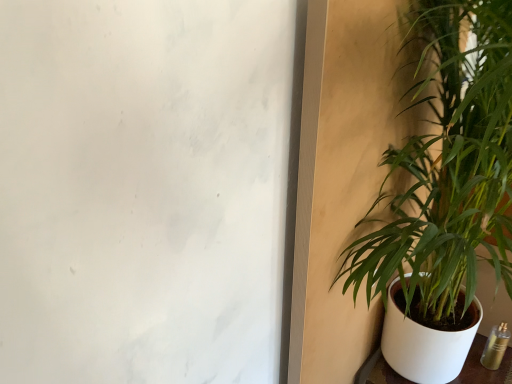
What do you see at coordinates (448, 168) in the screenshot?
I see `green leafy plant at right` at bounding box center [448, 168].

The height and width of the screenshot is (384, 512). Find the location of `green leafy plant at right`. green leafy plant at right is located at coordinates (448, 168).

The width and height of the screenshot is (512, 384). In order to click on white ceramic flowerpot at right in this screenshot , I will do [x=425, y=344].

Describe the element at coordinates (425, 344) in the screenshot. I see `white ceramic flowerpot at right` at that location.

I want to click on green leafy plant at right, so click(x=448, y=168).

Considering the relative positions of green leafy plant at right and white ceramic flowerpot at right in the image provided, is green leafy plant at right to the right of white ceramic flowerpot at right from the viewer's perspective?

No, green leafy plant at right is not to the right of white ceramic flowerpot at right.

Which is behind, green leafy plant at right or white ceramic flowerpot at right?

white ceramic flowerpot at right is behind.

Which point is more distant from viewer, (458, 152) or (391, 322)?

Point (391, 322)

From the image's perspective, does green leafy plant at right appear lower than white ceramic flowerpot at right?

Actually, green leafy plant at right appears above white ceramic flowerpot at right in the image.

From a real-world perspective, relative to white ceramic flowerpot at right, is green leafy plant at right vertically above or below?

green leafy plant at right is situated higher than white ceramic flowerpot at right in the real world.

Which of these two, green leafy plant at right or white ceramic flowerpot at right, is wider?

Wider between the two is white ceramic flowerpot at right.

Between green leafy plant at right and white ceramic flowerpot at right, which one has more height?

Standing taller between the two is green leafy plant at right.

Considering the sizes of objects green leafy plant at right and white ceramic flowerpot at right in the image provided, who is bigger, green leafy plant at right or white ceramic flowerpot at right?

Bigger between the two is green leafy plant at right.

Is green leafy plant at right not within white ceramic flowerpot at right?

That's correct, green leafy plant at right is outside of white ceramic flowerpot at right.

Would you consider green leafy plant at right to be distant from white ceramic flowerpot at right?

No, there isn't a large distance between green leafy plant at right and white ceramic flowerpot at right.

Is green leafy plant at right oriented towards white ceramic flowerpot at right?

No, green leafy plant at right is not facing towards white ceramic flowerpot at right.

How different are the orientations of green leafy plant at right and white ceramic flowerpot at right in degrees?

The angle between the facing direction of green leafy plant at right and the facing direction of white ceramic flowerpot at right is 1.37 degrees.

Measure the distance from green leafy plant at right to white ceramic flowerpot at right.

green leafy plant at right is 9.24 inches from white ceramic flowerpot at right.

At what (x,y) coordinates should I click in order to perform the action: click on flowerpot below the green leafy plant at right (from a real-world perspective). Please return your answer as a coordinate pair (x, y). Looking at the image, I should click on (425, 344).

Which object is positioned more to the left, white ceramic flowerpot at right or green leafy plant at right?

green leafy plant at right is more to the left.

In the scene shown: Is white ceramic flowerpot at right further to camera compared to green leafy plant at right?

Yes, it is.

Is point (466, 335) behind point (429, 202)?

Yes.

From the image's perspective, is white ceramic flowerpot at right on green leafy plant at right?

Incorrect, from the image's perspective, white ceramic flowerpot at right is lower than green leafy plant at right.

Looking at this image, from a real-world perspective, is white ceramic flowerpot at right above or below green leafy plant at right?

white ceramic flowerpot at right is situated lower than green leafy plant at right in the real world.

In the scene shown: Considering the relative sizes of white ceramic flowerpot at right and green leafy plant at right in the image provided, is white ceramic flowerpot at right thinner than green leafy plant at right?

No, white ceramic flowerpot at right is not thinner than green leafy plant at right.

Can you confirm if white ceramic flowerpot at right is shorter than green leafy plant at right?

Indeed, white ceramic flowerpot at right has a lesser height compared to green leafy plant at right.

Who is bigger, white ceramic flowerpot at right or green leafy plant at right?

Bigger between the two is green leafy plant at right.

Is green leafy plant at right completely or partially inside white ceramic flowerpot at right?

Actually, green leafy plant at right is outside white ceramic flowerpot at right.

Is white ceramic flowerpot at right with green leafy plant at right?

No, white ceramic flowerpot at right is not beside green leafy plant at right.

Is white ceramic flowerpot at right looking in the opposite direction of green leafy plant at right?

white ceramic flowerpot at right is not turned away from green leafy plant at right.

Locate an element on the screen. The height and width of the screenshot is (384, 512). houseplant that appears above the white ceramic flowerpot at right (from a real-world perspective) is located at coordinates (448, 168).

The height and width of the screenshot is (384, 512). In order to click on flowerpot behind the green leafy plant at right in this screenshot , I will do `click(425, 344)`.

Find the location of a particular element. flowerpot to the right of green leafy plant at right is located at coordinates (425, 344).